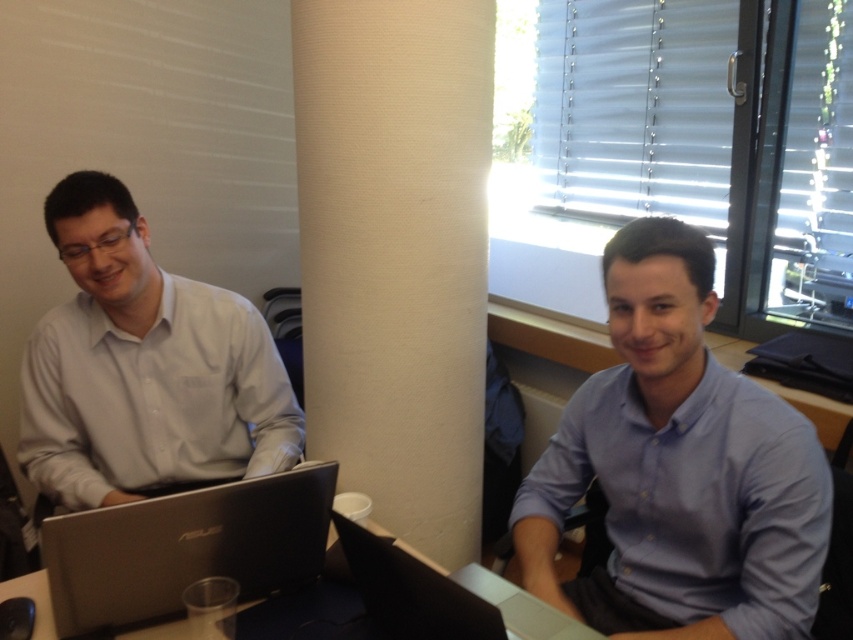
Does blue smooth shirt at center appear on the right side of silver metallic laptop at lower left?

Indeed, blue smooth shirt at center is positioned on the right side of silver metallic laptop at lower left.

Can you confirm if blue smooth shirt at center is bigger than silver metallic laptop at lower left?

Yes.

Image resolution: width=853 pixels, height=640 pixels. What do you see at coordinates (677, 468) in the screenshot? I see `blue smooth shirt at center` at bounding box center [677, 468].

Identify the location of blue smooth shirt at center. (677, 468).

Is silver metallic laptop at lower left wider than silver metallic table at lower center?

No.

Locate an element on the screen. silver metallic laptop at lower left is located at coordinates (184, 548).

Between blue smooth shirt at center and silver metallic laptop at center, which one has less height?

With less height is silver metallic laptop at center.

Which is behind, point (750, 496) or point (426, 612)?

The point (750, 496) is more distant.

Is point (671, 484) farther from viewer compared to point (397, 611)?

Yes, point (671, 484) is farther from viewer.

Locate an element on the screen. blue smooth shirt at center is located at coordinates (677, 468).